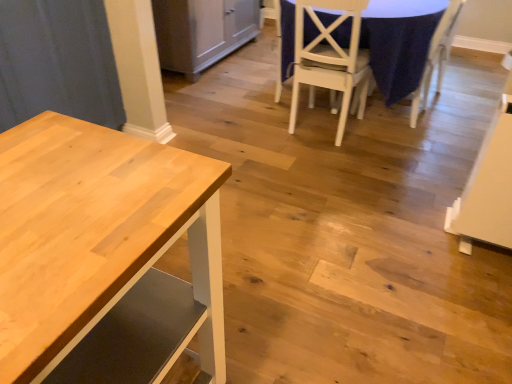
Question: Is white matte chair at center, the 2th chair viewed from the right, bigger than natural wood table at left?

Choices:
 (A) yes
 (B) no

Answer: (B)

Question: Can you confirm if white matte chair at center, the 2th chair viewed from the right, is thinner than natural wood table at left?

Choices:
 (A) no
 (B) yes

Answer: (A)

Question: From the image's perspective, is white matte chair at center, the 1th chair from the left, below natural wood table at left?

Choices:
 (A) no
 (B) yes

Answer: (A)

Question: Is white matte chair at center, the 2th chair viewed from the right, to the left of natural wood table at left from the viewer's perspective?

Choices:
 (A) no
 (B) yes

Answer: (A)

Question: Is the position of white matte chair at center, the 2th chair viewed from the right, less distant than that of natural wood table at left?

Choices:
 (A) yes
 (B) no

Answer: (B)

Question: Are white matte chair at center, the 2th chair viewed from the right, and natural wood table at left located far from each other?

Choices:
 (A) yes
 (B) no

Answer: (A)

Question: Would you consider matte gray cabinet at center to be distant from white fabric chair at upper right, acting as the 2th chair starting from the left?

Choices:
 (A) no
 (B) yes

Answer: (B)

Question: Is the depth of matte gray cabinet at center less than that of white fabric chair at upper right, acting as the 2th chair starting from the left?

Choices:
 (A) yes
 (B) no

Answer: (B)

Question: Considering the relative sizes of matte gray cabinet at center and white fabric chair at upper right, the 1th chair in the right-to-left sequence, in the image provided, is matte gray cabinet at center bigger than white fabric chair at upper right, the 1th chair in the right-to-left sequence,?

Choices:
 (A) yes
 (B) no

Answer: (A)

Question: From the image's perspective, is matte gray cabinet at center below white fabric chair at upper right, the 1th chair in the right-to-left sequence?

Choices:
 (A) yes
 (B) no

Answer: (B)

Question: From a real-world perspective, does matte gray cabinet at center sit lower than white fabric chair at upper right, acting as the 2th chair starting from the left?

Choices:
 (A) yes
 (B) no

Answer: (A)

Question: Is the surface of matte gray cabinet at center in direct contact with white fabric chair at upper right, the 1th chair in the right-to-left sequence?

Choices:
 (A) no
 (B) yes

Answer: (A)

Question: Considering the relative sizes of blue fabric tablecloth at center and white fabric chair at upper right, acting as the 2th chair starting from the left, in the image provided, is blue fabric tablecloth at center smaller than white fabric chair at upper right, acting as the 2th chair starting from the left,?

Choices:
 (A) yes
 (B) no

Answer: (B)